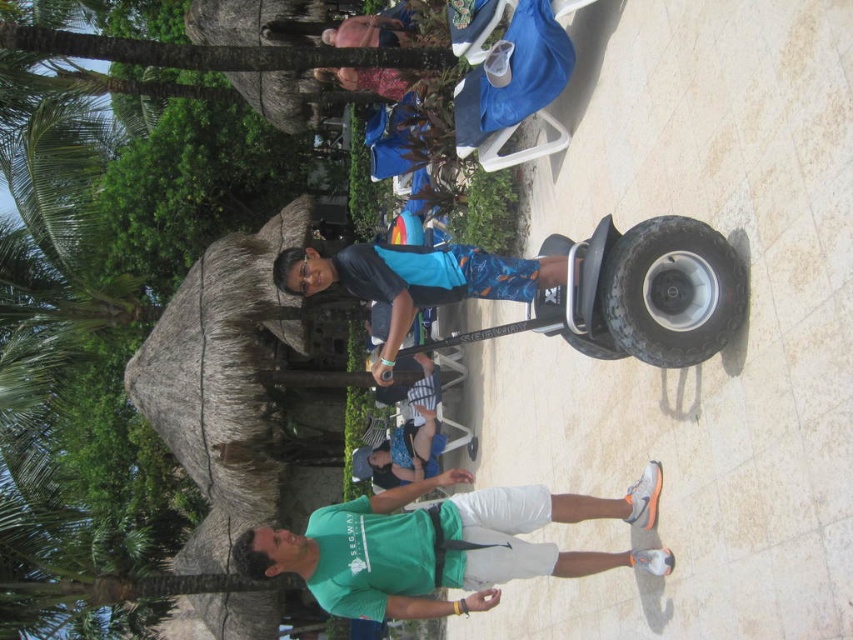
Who is more distant from viewer, (717,320) or (450,272)?

Positioned behind is point (450,272).

Is point (666, 282) in front of point (409, 326)?

Yes, it is in front of point (409, 326).

This screenshot has width=853, height=640. In order to click on black rubber tire at center in this screenshot , I will do `click(672, 291)`.

Who is positioned more to the left, blue fabric shorts at center or denim shorts at lower center?

Positioned to the left is blue fabric shorts at center.

Does blue fabric shorts at center appear on the left side of denim shorts at lower center?

Correct, you'll find blue fabric shorts at center to the left of denim shorts at lower center.

Is point (490, 273) closer to camera compared to point (444, 435)?

Yes, it is.

Where is `blue fabric shorts at center`? The image size is (853, 640). blue fabric shorts at center is located at coordinates click(x=415, y=280).

Between green fabric shirt at lower center and blue fabric shorts at center, which one is positioned higher?

blue fabric shorts at center is higher up.

Is the position of green fabric shirt at lower center less distant than that of blue fabric shorts at center?

Yes, it is in front of blue fabric shorts at center.

Does point (370, 513) come closer to viewer compared to point (293, 262)?

That is True.

This screenshot has width=853, height=640. What are the coordinates of `green fabric shirt at lower center` in the screenshot? It's located at (442, 545).